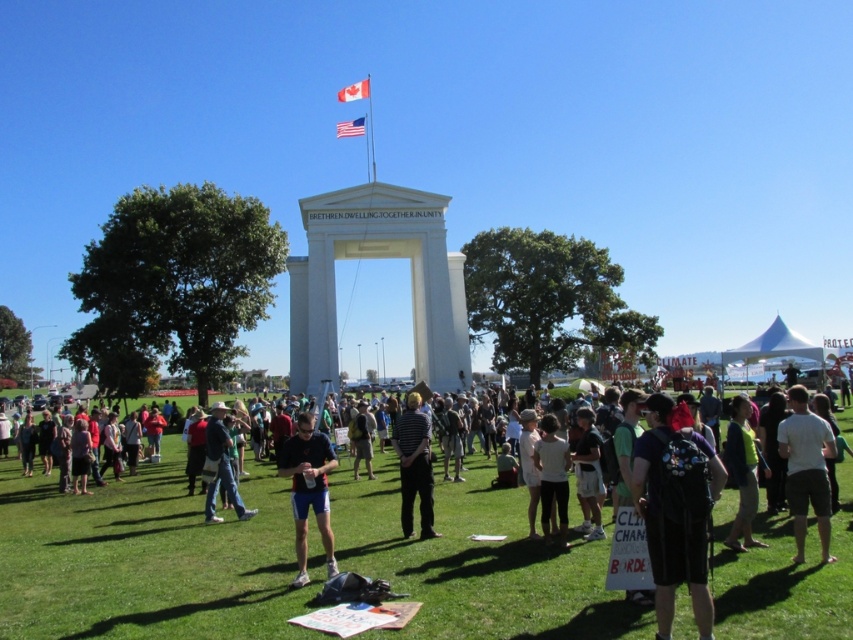
You are a photographer trying to capture a wide shot of the event. You need to ensure both the green grass at lower center and the american flag at upper center are visible. Which object will occupy more horizontal space in the photo?

The green grass at lower center will occupy more horizontal space in the photo because its width surpasses that of the american flag at upper center.